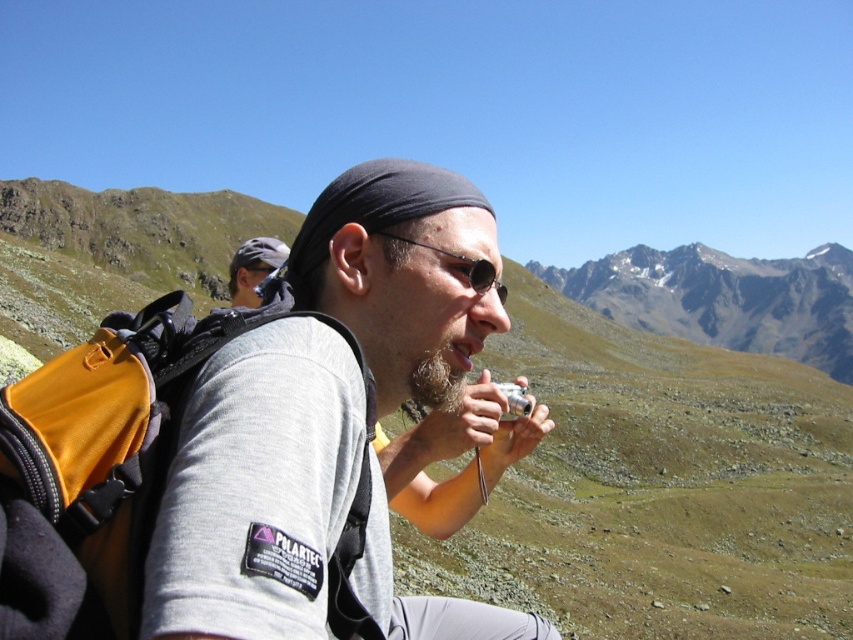
Question: In this image, where is yellow fabric backpack at left located relative to black reflective sunglasses at center?

Choices:
 (A) below
 (B) above

Answer: (A)

Question: Which of these objects is positioned farthest from the yellow fabric backpack at left?

Choices:
 (A) matte gray cap at upper left
 (B) gray fabric shirt at center
 (C) black reflective sunglasses at center
 (D) white rocky mountain at upper center

Answer: (D)

Question: Observing the image, what is the correct spatial positioning of gray fabric shirt at center in reference to yellow fabric backpack at left?

Choices:
 (A) left
 (B) right

Answer: (B)

Question: Which object appears farthest from the camera in this image?

Choices:
 (A) white rocky mountain at upper center
 (B) black reflective sunglasses at center

Answer: (A)

Question: Which of these objects is positioned farthest from the matte gray cap at upper left?

Choices:
 (A) black reflective sunglasses at center
 (B) yellow fabric backpack at left
 (C) gray fabric shirt at center
 (D) white rocky mountain at upper center

Answer: (D)

Question: Is gray fabric shirt at center smaller than matte gray cap at upper left?

Choices:
 (A) no
 (B) yes

Answer: (B)